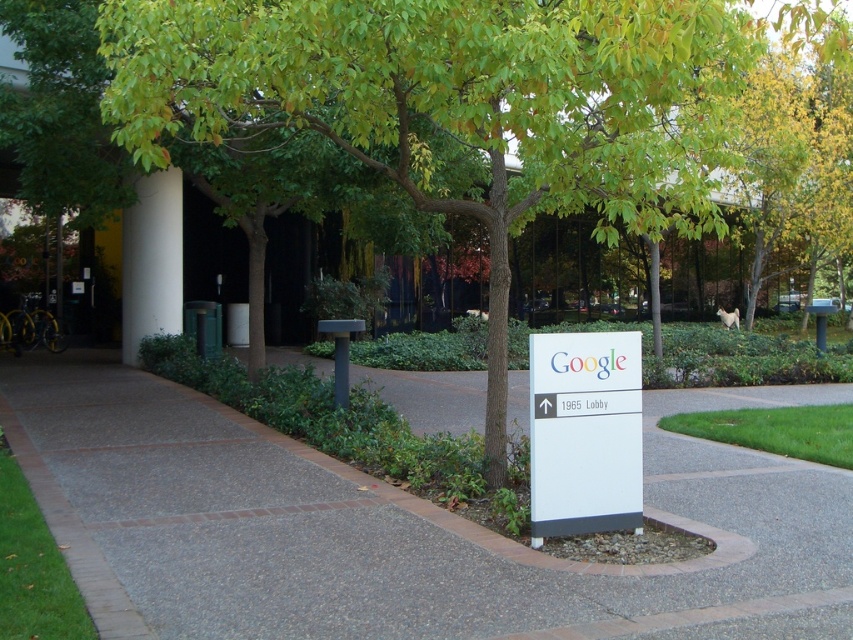
Question: Which object is positioned farthest from the white plastic sign at center?

Choices:
 (A) white smooth pillar at center-left
 (B) gray concrete pavement at center

Answer: (A)

Question: Among these objects, which one is nearest to the camera?

Choices:
 (A) white plastic sign at center
 (B) white smooth pillar at center-left
 (C) gray concrete pavement at center

Answer: (C)

Question: Is gray concrete pavement at center thinner than white plastic sign at center?

Choices:
 (A) yes
 (B) no

Answer: (B)

Question: Observing the image, what is the correct spatial positioning of white plastic sign at center in reference to white smooth pillar at center-left?

Choices:
 (A) below
 (B) above

Answer: (A)

Question: Which object is closer to the camera taking this photo?

Choices:
 (A) white plastic sign at center
 (B) white smooth pillar at center-left

Answer: (A)

Question: Is white plastic sign at center positioned behind white smooth pillar at center-left?

Choices:
 (A) no
 (B) yes

Answer: (A)